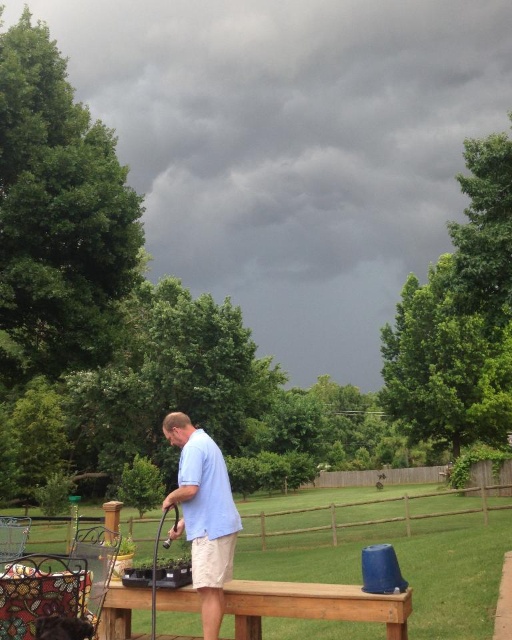
You are standing at the edge of the grassy lawn and see the brown wooden picnic table at center and the light blue shirt at center. Which object is closer to you?

The brown wooden picnic table at center is closer to you since it is located below the light blue shirt at center, meaning it is positioned lower in the image and thus nearer to the observer.

You are standing at the entrance of the garden and want to find the brown wooden picnic table at center. According to the coordinates provided, where should you look relative to the entrance?

The brown wooden picnic table at center is located at coordinates point (312,605), which is towards the lower right of the image from the entrance perspective.

You are standing in the garden and want to place a new potted plant between the brown wooden picnic table at center and the light blue shirt at center. Which object should you place the plant closer to if you want it to be farther from you?

You should place the plant closer to the light blue shirt at center because the brown wooden picnic table at center is closer to you, so placing it near the shirt would make it farther away.